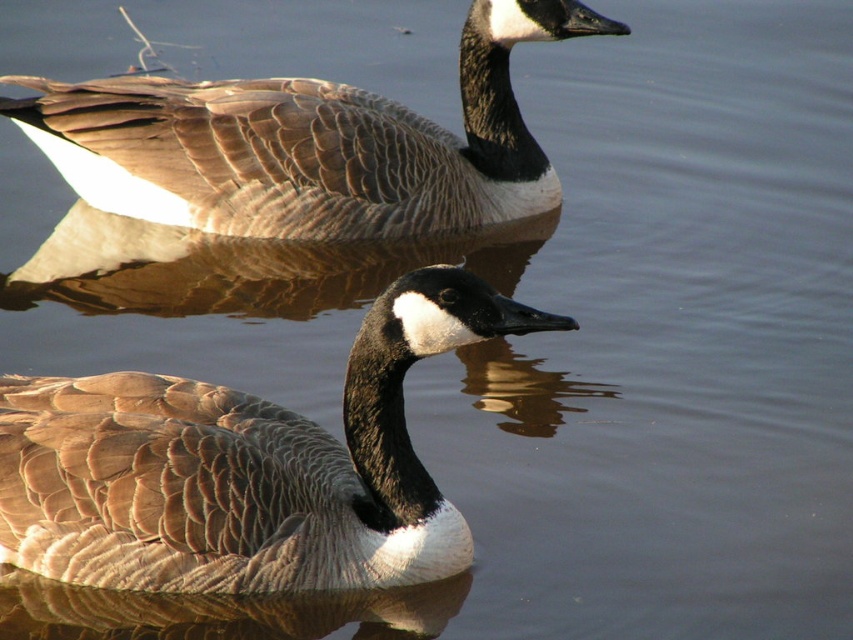
You are taking a photo of the two Canada geese in the scene. You want to focus on the point closer to the camera. Which point should you choose between point (38,564) and point (184,90)?

Point (38,564) is closer to the camera than point (184,90), so you should choose point (38,564) to focus on.

You are a wildlife photographer aiming to capture both brown feathered duck at center and brown feathered duck at upper center in a single shot. Given that your camera has a maximum focus range of 6 feet, will you be able to include both ducks in the photo?

The distance between the brown feathered duck at center and the brown feathered duck at upper center is 6.27 feet, which exceeds the camera maximum focus range of 6 feet. Therefore, you cannot capture both ducks in a single shot.